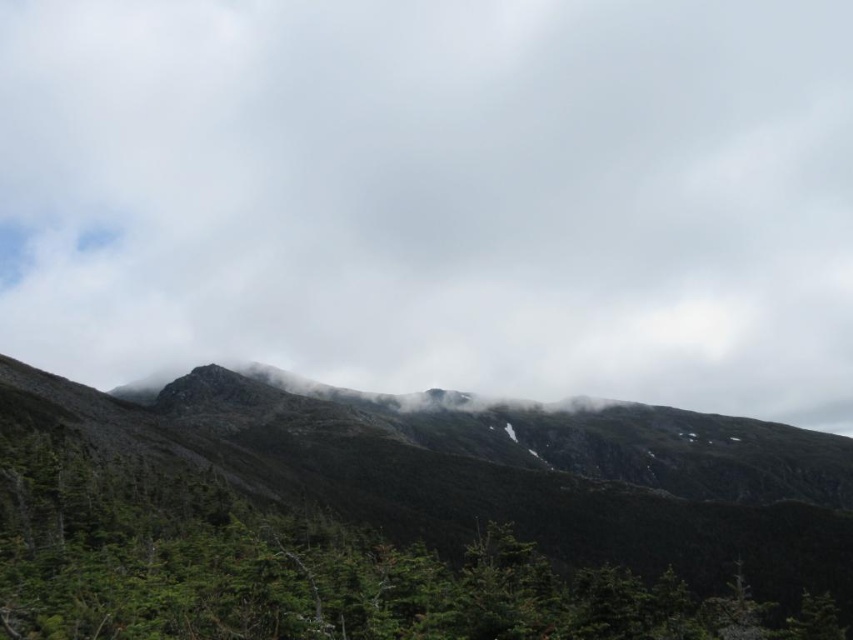
You are a photographer standing in the mountain landscape. You want to take a photo that includes both the point at coordinates point (851, 426) and point (646, 602). Which point is closer to your camera position?

Point (646, 602) is closer to the camera than point (851, 426), so you should position your camera to ensure both points are in frame by focusing on the closer point first.

You are a drone operator planning to capture aerial footage of the mountain landscape. The drone has a maximum flight range of 300 meters from its starting point. If you position the drone at the base of the mountain, which is located at point coordinates of 0.0, 0.0, will the white fluffy cloud at upper center be within the drone camera view range?

The white fluffy cloud at upper center is located at coordinates (436, 195). To determine if it is within the 300 meter range, we need to calculate the distance between the drone at (0, 0) and the cloud at (436, 195). Using the distance formula sqrt. However, the problem is that the coordinate system here is not specified in meters. Without knowing the scale of the coordinate system, we cannot accurately determine the distance in meters. Therefore, it is impossible to confirm whether the cloud is in.